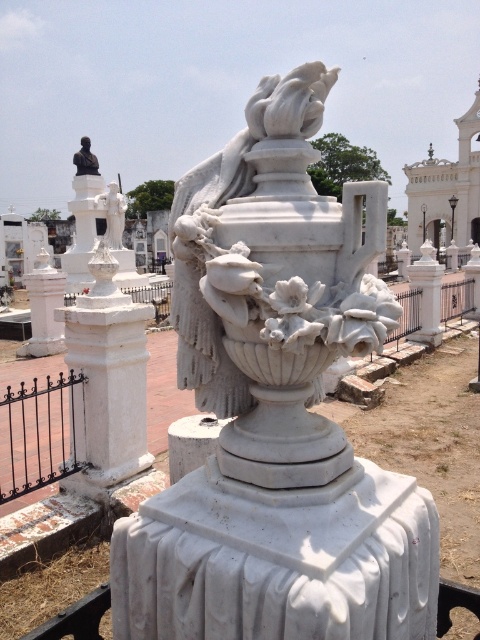
Question: Does white marble pillar at left have a lesser width compared to matte white statue at upper left?

Choices:
 (A) yes
 (B) no

Answer: (B)

Question: Does white marble post at left appear over black wrought iron fence at left?

Choices:
 (A) no
 (B) yes

Answer: (B)

Question: Considering the real-world distances, which object is farthest from the black wrought iron fence at left?

Choices:
 (A) white marble pillar at left
 (B) matte white statue at upper left
 (C) white marble post at left

Answer: (B)

Question: Which object is farther from the camera taking this photo?

Choices:
 (A) matte white statue at upper left
 (B) matte black statue at upper left
 (C) white marble pillar at left
 (D) white marble post at left

Answer: (B)

Question: Can you confirm if white marble urn at center is thinner than white marble post at left?

Choices:
 (A) yes
 (B) no

Answer: (A)

Question: Which of these objects is positioned farthest from the black wrought iron fence at left?

Choices:
 (A) white marble urn at center
 (B) white marble fence at right
 (C) white marble pillar at left
 (D) matte white statue at upper left

Answer: (D)